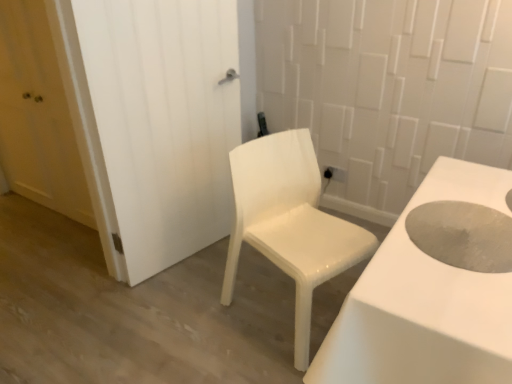
Where is `vacant space underneath white matte door at center, which is the 1th door from right to left (from a real-world perspective)`? The height and width of the screenshot is (384, 512). vacant space underneath white matte door at center, which is the 1th door from right to left (from a real-world perspective) is located at coordinates (179, 257).